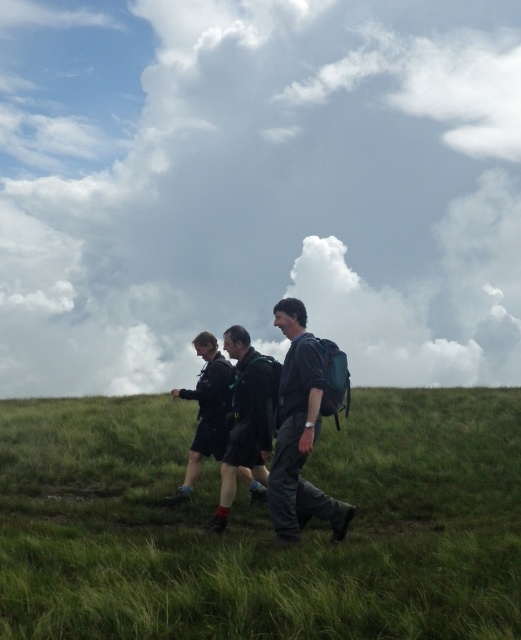
You are planning to take a photo of the dark blue backpack at center and the green grassy at center. Which object should you focus on first if you want to capture both in the frame without moving the camera?

The green grassy at center should be focused on first because its width is larger than the dark blue backpack at center, allowing it to occupy more space in the frame and ensuring both objects are captured without needing to adjust the camera position.

You are one of the hikers in the image. You want to place a small marker on the ground between the green grassy at center and the dark blue backpack at center. Where should you place it?

The green grassy at center is in front of the dark blue backpack at center, so you should place the marker between them, closer to the green grassy at center to ensure it is in front of the backpack.

You are standing in the grassy field and want to look up at the cloudy sky at upper center. Do you need to tilt your head back more compared to looking at the dark blue backpack at center?

Yes, because the cloudy sky at upper center is further away from you than the dark blue backpack at center, so you need to tilt your head back more to look at it.